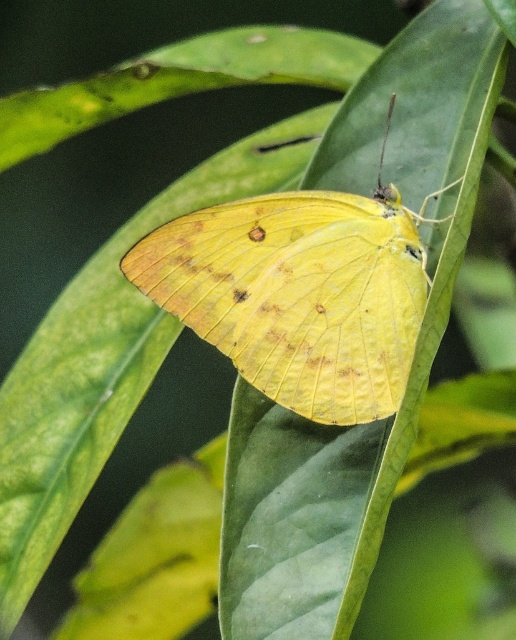
Is green matte leaf at center to the right of yellow matte butterfly at center from the viewer's perspective?

Correct, you'll find green matte leaf at center to the right of yellow matte butterfly at center.

Does green matte leaf at center have a lesser height compared to yellow matte butterfly at center?

No.

Between point (294, 413) and point (220, 224), which one is positioned in front?

Point (220, 224) is more forward.

Where is `green matte leaf at center`? green matte leaf at center is located at coordinates (414, 352).